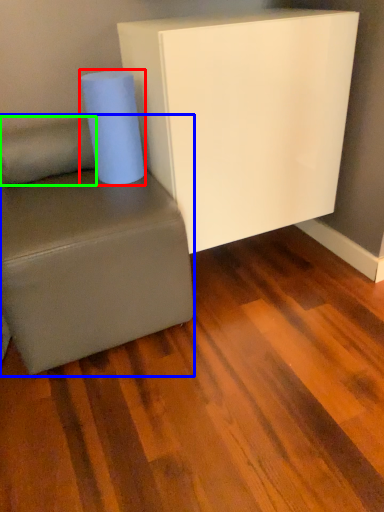
Question: Based on their relative distances, which object is nearer to paper towel (highlighted by a red box)? Choose from studio couch (highlighted by a blue box) and pillow (highlighted by a green box).

Choices:
 (A) studio couch
 (B) pillow

Answer: (B)